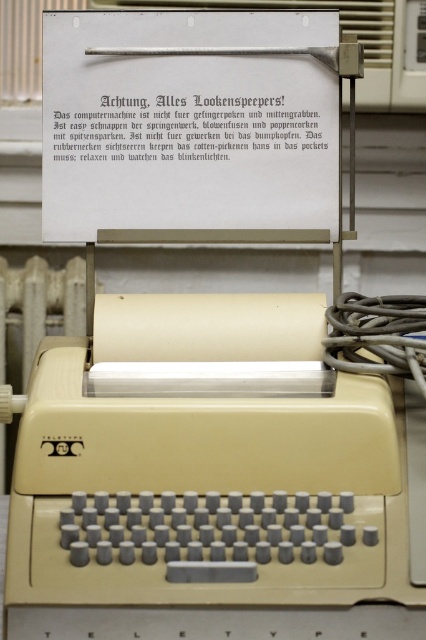
Between point (180, 154) and point (69, 312), which one is positioned behind?

The point (69, 312) is more distant.

Is white paper at upper center positioned behind beige plastic radiator at lower left?

No, it is in front of beige plastic radiator at lower left.

Image resolution: width=426 pixels, height=640 pixels. What do you see at coordinates (183, 129) in the screenshot?
I see `white paper at upper center` at bounding box center [183, 129].

Identify the location of white paper at upper center. This screenshot has width=426, height=640. (183, 129).